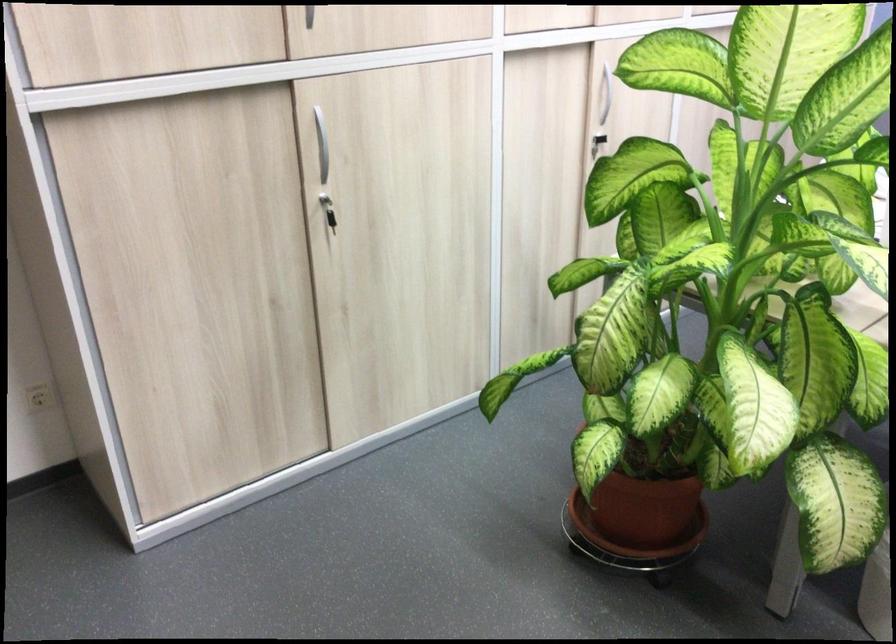
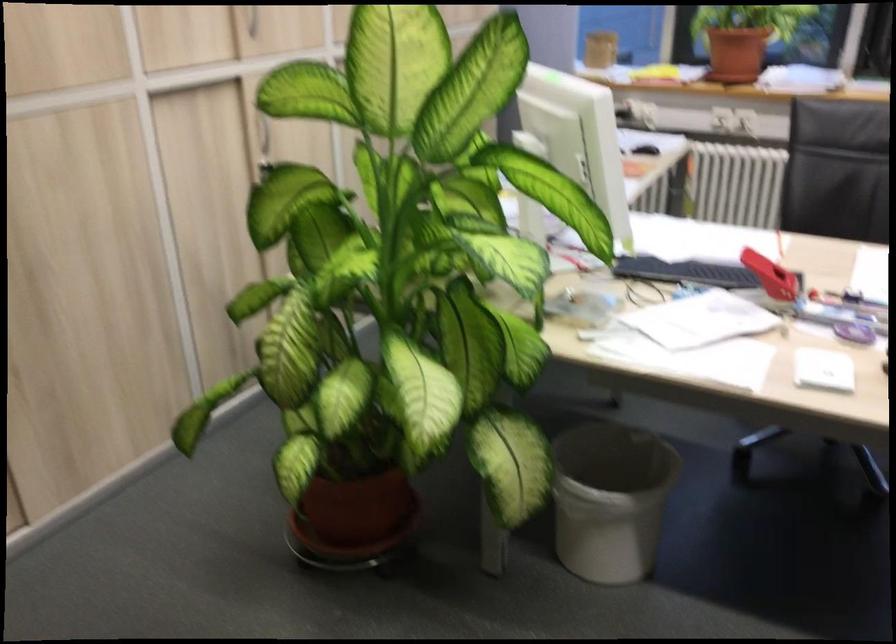
Which direction would the cameraman need to move to produce the second image?

The cameraman walked toward right, backward.